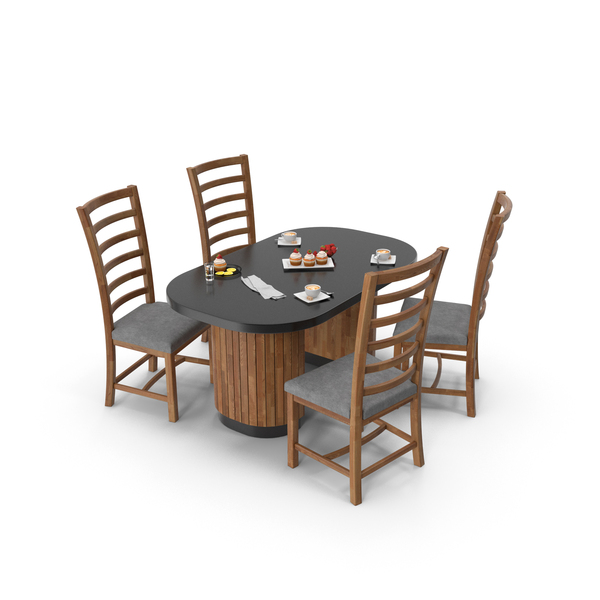
Where is `mug`? mug is located at coordinates (289, 235).